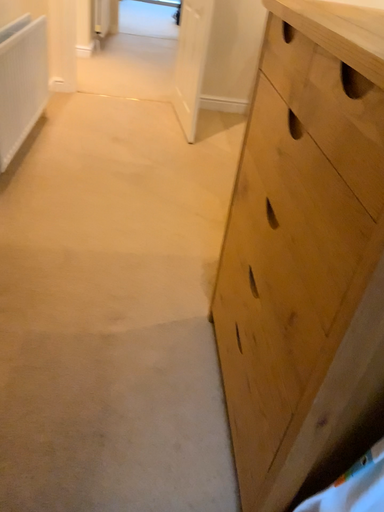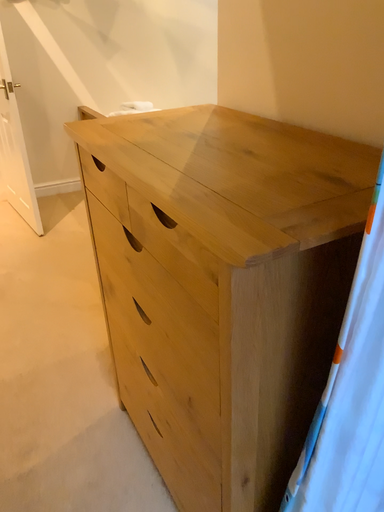
Question: Which way did the camera rotate in the video?

Choices:
 (A) rotated upward
 (B) rotated downward

Answer: (A)